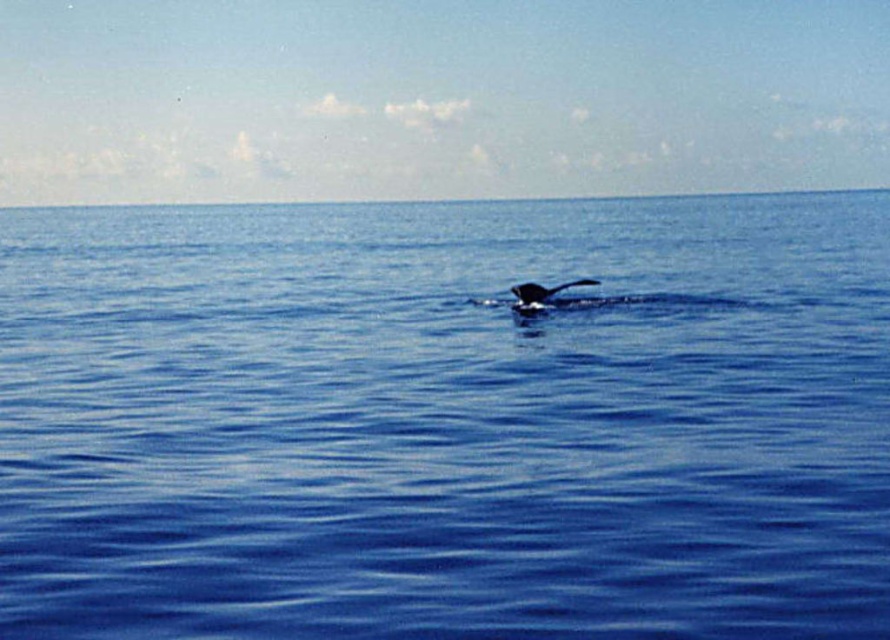
You are a marine biologist studying the ocean. You observe the blue water at center and the gray matte whale at center in the image. Which object is wider?

The blue water at center is wider than the gray matte whale at center.

Looking at this image, you are a marine biologist observing the ocean scene. You need to determine which object takes up more space in the image. Based on the scene, which one is bigger between the blue water at center and the gray matte whale at center?

The blue water at center has a larger size compared to the gray matte whale at center, so the blue water at center is bigger.